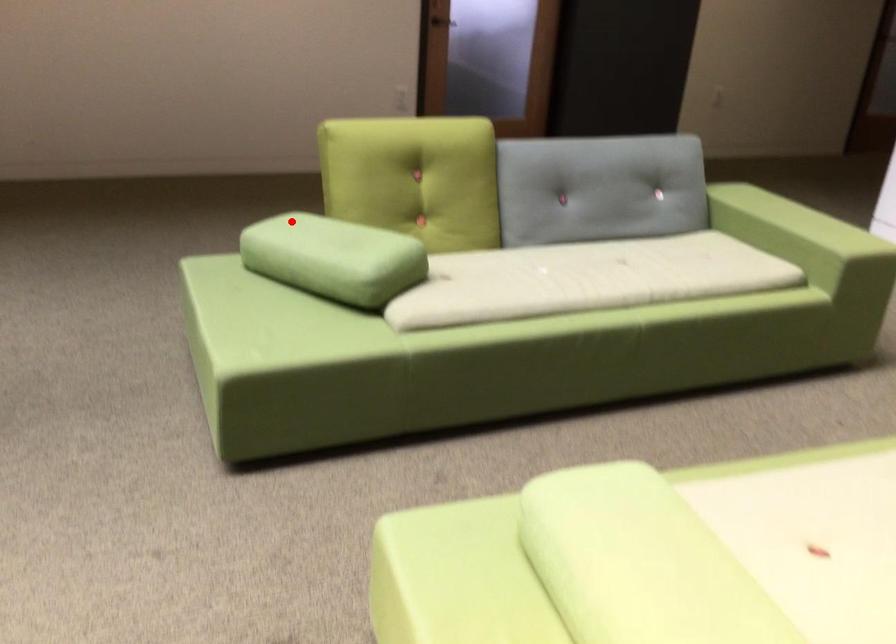
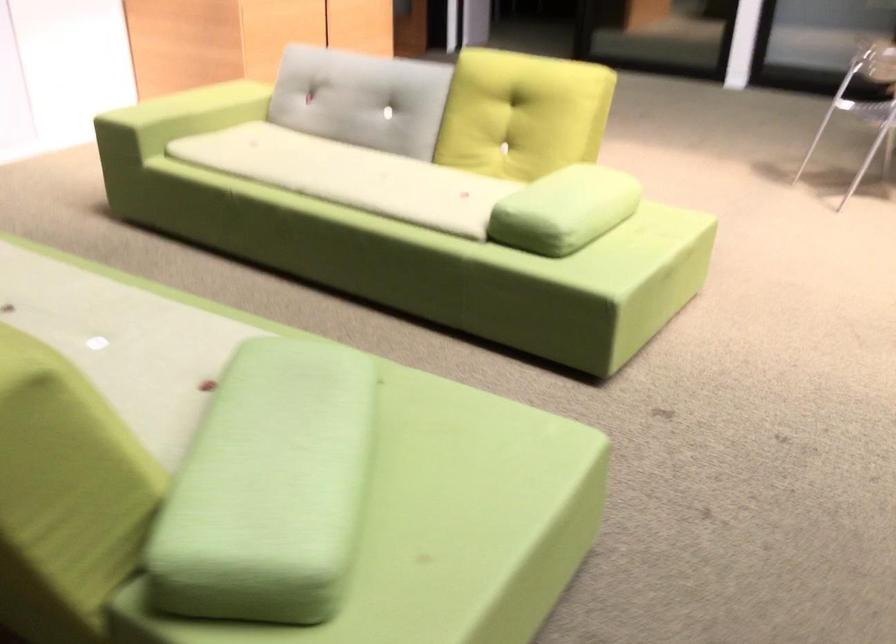
Question: I am providing you with two images of the same scene from different viewpoints. In image1, a red point is highlighted. Considering the same 3D point in image2, which of the following is correct?

Choices:
 (A) It is closer
 (B) It is farther

Answer: (A)